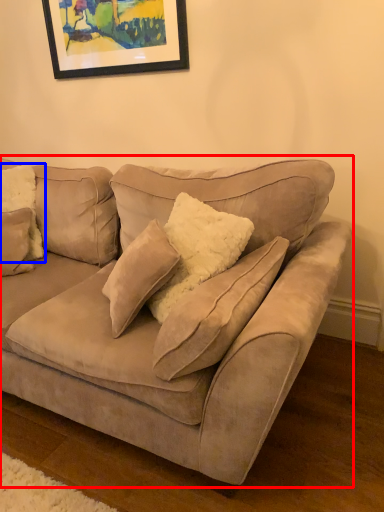
Question: Which of the following is the farthest to the observer, studio couch (highlighted by a red box) or pillow (highlighted by a blue box)?

Choices:
 (A) studio couch
 (B) pillow

Answer: (B)